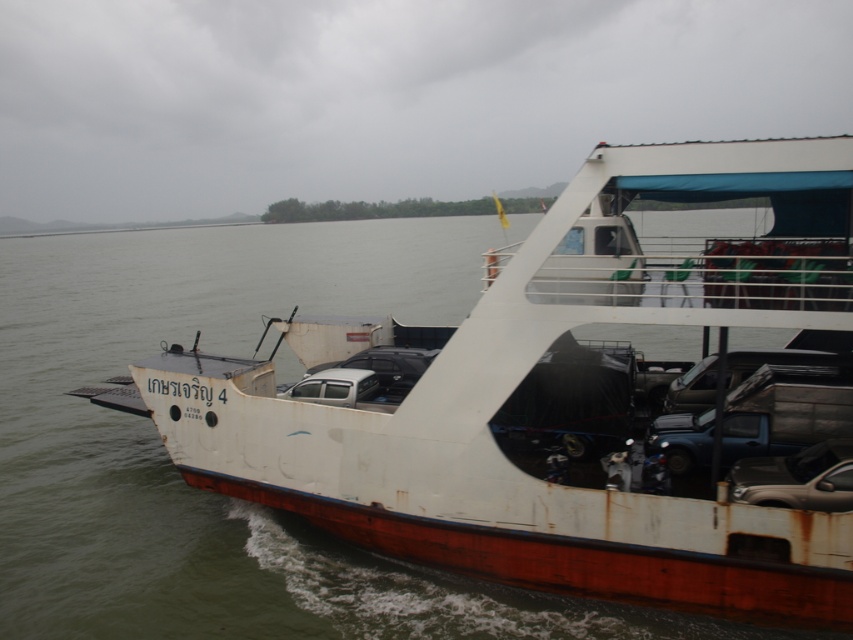
Question: Which point is closer to the camera taking this photo?

Choices:
 (A) (793, 502)
 (B) (250, 404)

Answer: (A)

Question: Observing the image, what is the correct spatial positioning of white matte boat at center in reference to shiny silver car at lower right?

Choices:
 (A) left
 (B) right

Answer: (A)

Question: Among these points, which one is nearest to the camera?

Choices:
 (A) click(x=485, y=556)
 (B) click(x=834, y=440)

Answer: (B)

Question: Which of the following is the closest to the observer?

Choices:
 (A) shiny silver car at lower right
 (B) white matte boat at center

Answer: (B)

Question: Does white matte boat at center have a lesser width compared to shiny silver car at lower right?

Choices:
 (A) yes
 (B) no

Answer: (B)

Question: Is white matte boat at center to the left of shiny silver car at lower right from the viewer's perspective?

Choices:
 (A) yes
 (B) no

Answer: (A)